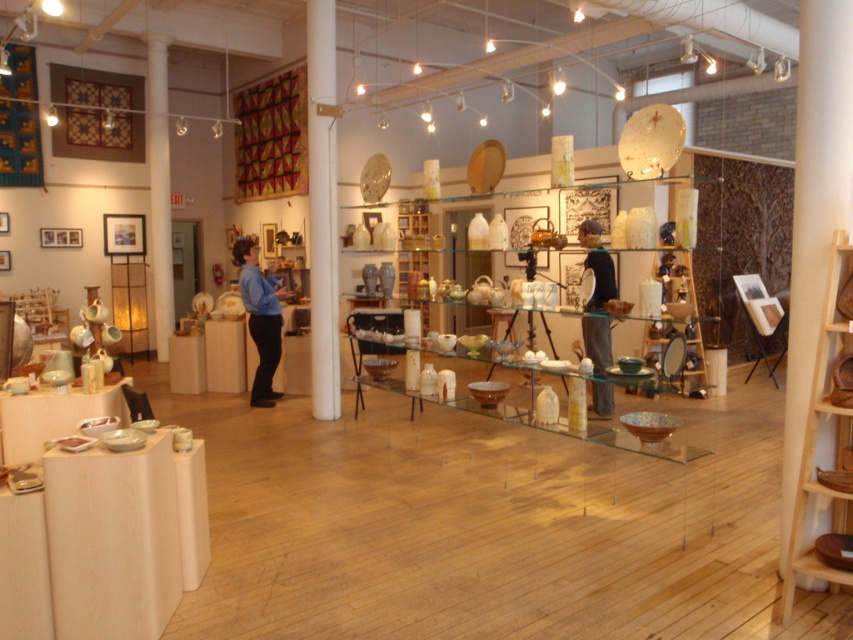
You are standing in the pottery studio and want to place a 10 feet long sculpture on the transparent glass table at center. Is the table long enough to accommodate the sculpture?

The transparent glass table at center and viewer are 12.32 feet apart. The distance between the viewer and the table does not indicate the table length. Therefore, it is impossible to determine if the table is long enough based on the provided information.

You are a visitor in the pottery studio and you want to place a 1.5 meter long wooden plank on the floor between the transparent glass table at center and the black fabric shirt at center. Is there enough space for the plank to fit horizontally between them?

The transparent glass table at center is 1.41 meters away from the black fabric shirt at center. Since the plank is 1.5 meters long, it will not fit horizontally between them as the distance is shorter than the plank.

You are standing in the pottery studio and want to place a large ceramic vase on the transparent glass table at center. If the vase is 2 meters tall, will it fit on the table?

The transparent glass table at center is located at point (492, 403), but there is no information provided about its height or dimensions. Therefore, it is impossible to determine if the vase will fit based on the given information.